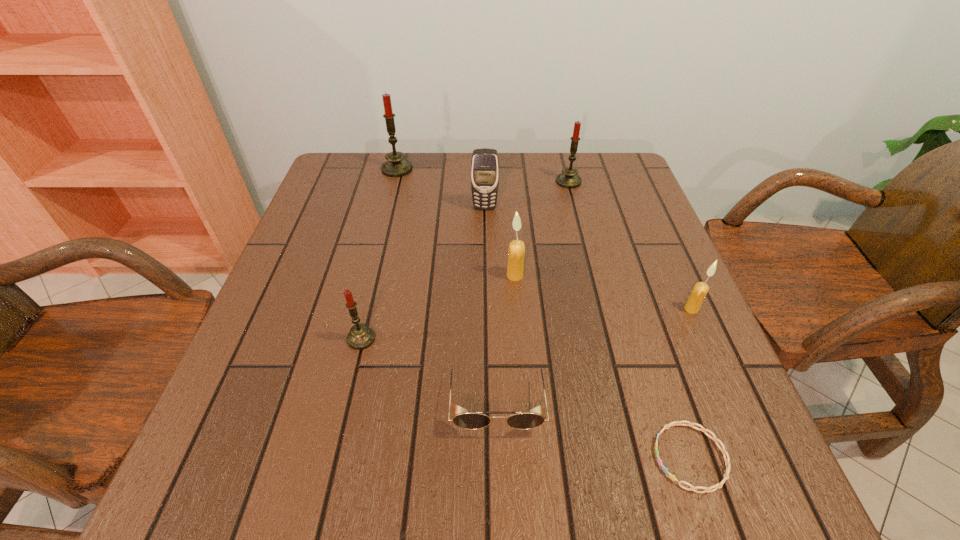
Image resolution: width=960 pixels, height=540 pixels. In order to click on free space at the far edge of the desktop in this screenshot , I will do (x=464, y=173).

At what (x,y) coordinates should I click in order to perform the action: click on free location at the near edge. Please return your answer as a coordinate pair (x, y). This screenshot has height=540, width=960. Looking at the image, I should click on (508, 459).

In the image, there is a desktop. Where is `vacant space at the left edge`? The width and height of the screenshot is (960, 540). vacant space at the left edge is located at coordinates (355, 251).

This screenshot has height=540, width=960. In order to click on free space at the right edge of the desktop in this screenshot , I will do `click(619, 221)`.

Identify the location of vacant position at the far left corner of the desktop. The image size is (960, 540). (378, 159).

You are a GUI agent. You are given a task and a screenshot of the screen. Output one action in this format:
    pyautogui.click(x=<x>, y=<y>)
    Task: Click on the free location at the near left corner of the desktop
    The width and height of the screenshot is (960, 540).
    Given the screenshot: What is the action you would take?
    pyautogui.click(x=216, y=494)

The image size is (960, 540). I want to click on free area in between the blue bracelet and the third farthest object, so click(588, 332).

The width and height of the screenshot is (960, 540). In order to click on vacant area that lies between the third farthest object and the sunglasses in this screenshot , I will do `click(491, 303)`.

Identify the location of unoccupied area between the nearest red candle and the third candle from right to left. Image resolution: width=960 pixels, height=540 pixels. (438, 307).

You are a GUI agent. You are given a task and a screenshot of the screen. Output one action in this format:
    pyautogui.click(x=<x>, y=<y>)
    Task: Click on the free space that is in between the sunglasses and the tallest object
    
    Given the screenshot: What is the action you would take?
    pyautogui.click(x=446, y=284)